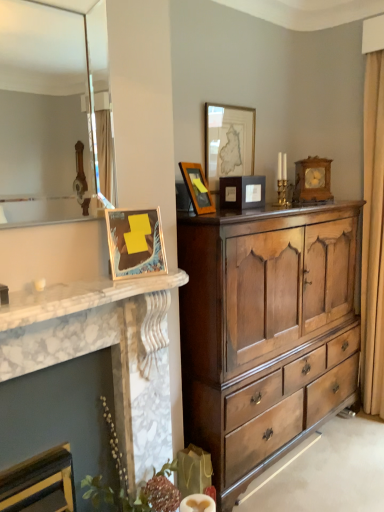
Question: Is wooden clock at upper right, the 5th picture frame viewed from the front, turned away from white marble fireplace at left?

Choices:
 (A) yes
 (B) no

Answer: (B)

Question: From the image's perspective, does wooden clock at upper right, placed as the 1th picture frame when sorted from back to front, appear higher than white marble fireplace at left?

Choices:
 (A) no
 (B) yes

Answer: (B)

Question: Is wooden clock at upper right, placed as the 1th picture frame when sorted from back to front, smaller than white marble fireplace at left?

Choices:
 (A) yes
 (B) no

Answer: (B)

Question: Is wooden clock at upper right, arranged as the fifth picture frame when viewed from the left, to the right of white marble fireplace at left from the viewer's perspective?

Choices:
 (A) yes
 (B) no

Answer: (A)

Question: Would you consider wooden clock at upper right, placed as the 1th picture frame when sorted from back to front, to be distant from white marble fireplace at left?

Choices:
 (A) yes
 (B) no

Answer: (A)

Question: Would you say matte wooden picture frame at center, which is the 2th picture frame from right to left, is to the left or to the right of metallic gold picture frame at left, which is the fifth picture frame from back to front, in the picture?

Choices:
 (A) right
 (B) left

Answer: (A)

Question: Is point (248, 201) closer or farther from the camera than point (125, 243)?

Choices:
 (A) closer
 (B) farther

Answer: (B)

Question: Is matte wooden picture frame at center, which is the third picture frame in back-to-front order, taller or shorter than metallic gold picture frame at left, which ranks as the 5th picture frame in right-to-left order?

Choices:
 (A) tall
 (B) short

Answer: (B)

Question: Is matte wooden picture frame at center, which is the third picture frame in back-to-front order, in front of or behind metallic gold picture frame at left, which ranks as the first picture frame in left-to-right order, in the image?

Choices:
 (A) front
 (B) behind

Answer: (B)

Question: Based on their positions, is matte glass mirror at upper left located to the left or right of matte wooden picture frame at upper center, the second picture frame when ordered from back to front?

Choices:
 (A) right
 (B) left

Answer: (B)

Question: From their relative heights in the image, would you say matte glass mirror at upper left is taller or shorter than matte wooden picture frame at upper center, the 4th picture frame in the front-to-back sequence?

Choices:
 (A) short
 (B) tall

Answer: (B)

Question: Considering their positions, is matte glass mirror at upper left located in front of or behind matte wooden picture frame at upper center, the 4th picture frame in the front-to-back sequence?

Choices:
 (A) behind
 (B) front

Answer: (B)

Question: From a real-world perspective, is matte glass mirror at upper left above or below matte wooden picture frame at upper center, the 4th picture frame in the front-to-back sequence?

Choices:
 (A) above
 (B) below

Answer: (A)

Question: Relative to matte glass mirror at upper left, is matte wooden picture frame at center, which is the third picture frame in back-to-front order, in front or behind?

Choices:
 (A) behind
 (B) front

Answer: (A)

Question: Is matte wooden picture frame at center, acting as the 4th picture frame starting from the left, to the left or to the right of matte glass mirror at upper left in the image?

Choices:
 (A) left
 (B) right

Answer: (B)